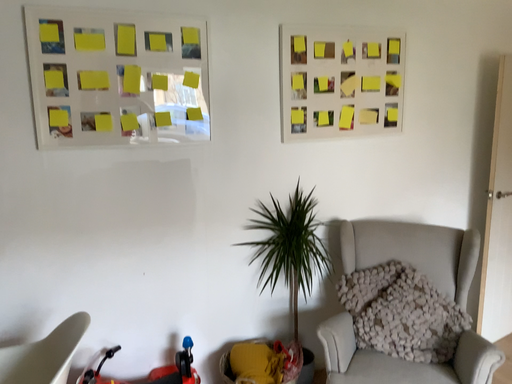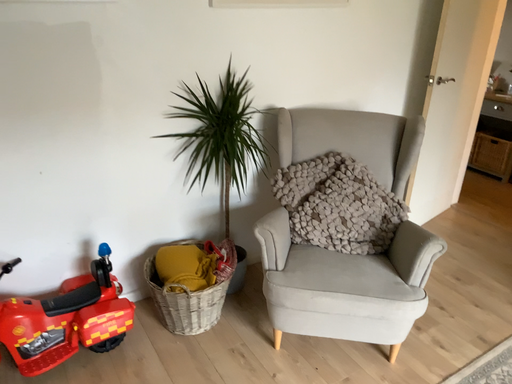
Question: How did the camera likely rotate when shooting the video?

Choices:
 (A) rotated upward
 (B) rotated downward

Answer: (B)